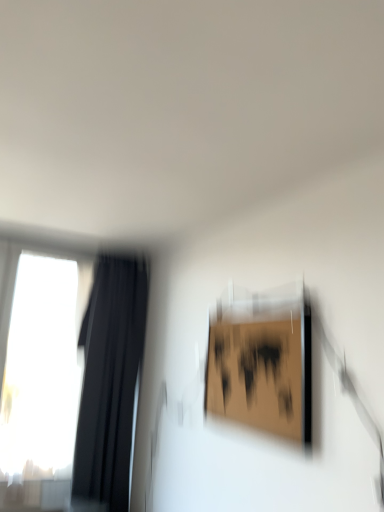
Question: Looking at their shapes, would you say transparent glass window at left is wider or thinner than black fabric curtain at left?

Choices:
 (A) thin
 (B) wide

Answer: (A)

Question: Considering the relative positions of transparent glass window at left and black fabric curtain at left in the image provided, is transparent glass window at left to the left or to the right of black fabric curtain at left?

Choices:
 (A) left
 (B) right

Answer: (A)

Question: Which object is positioned farthest from the wooden frame at upper right?

Choices:
 (A) transparent glass window at left
 (B) black fabric curtain at left

Answer: (A)

Question: Which object is the closest to the wooden frame at upper right?

Choices:
 (A) transparent glass window at left
 (B) black fabric curtain at left

Answer: (B)